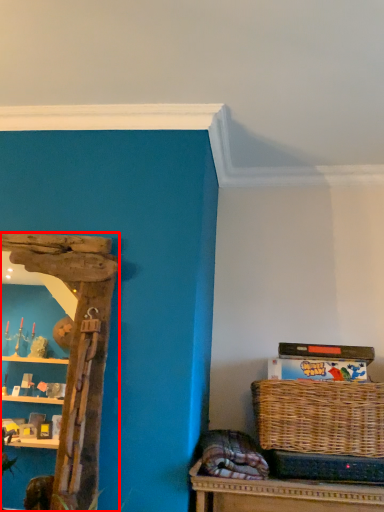
Question: From the image's perspective, what is the correct spatial relationship of shelf (annotated by the red box) in relation to picnic basket?

Choices:
 (A) above
 (B) below

Answer: (A)